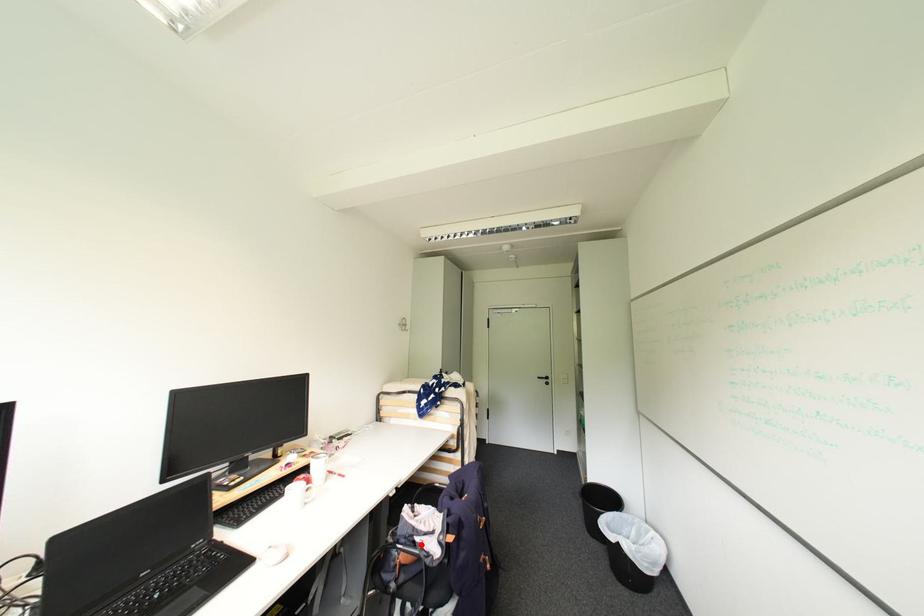
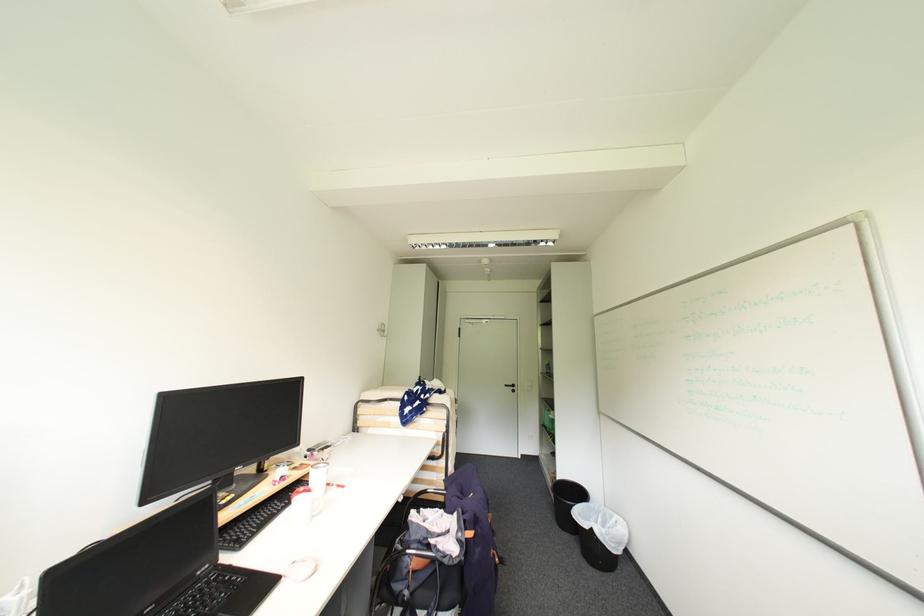
The point at the highlighted location is marked in the first image. Where is the corresponding point in the second image?

(435, 548)